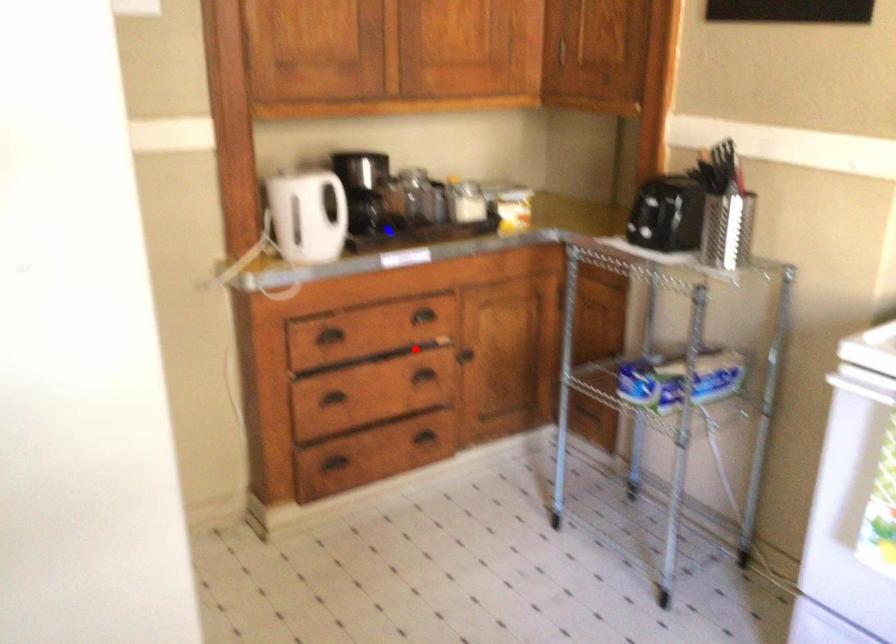
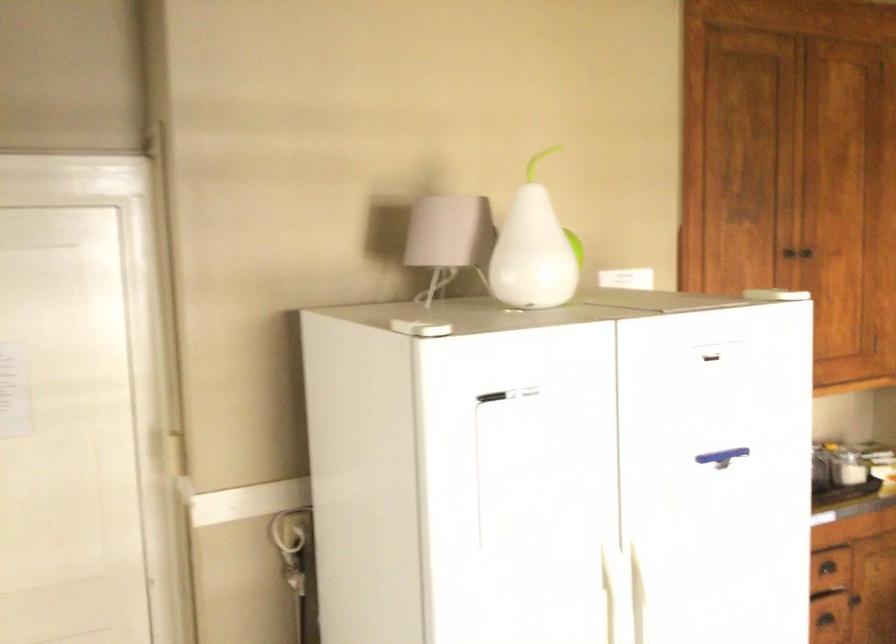
In the second image, find the point that corresponds to the highlighted location in the first image.

(824, 619)